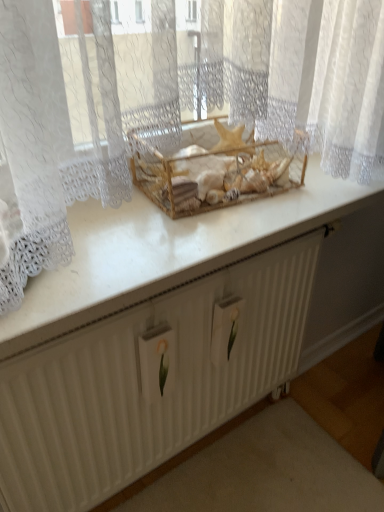
Where is `vacant space to the right of white textured radiator at center`? This screenshot has height=512, width=384. vacant space to the right of white textured radiator at center is located at coordinates (301, 438).